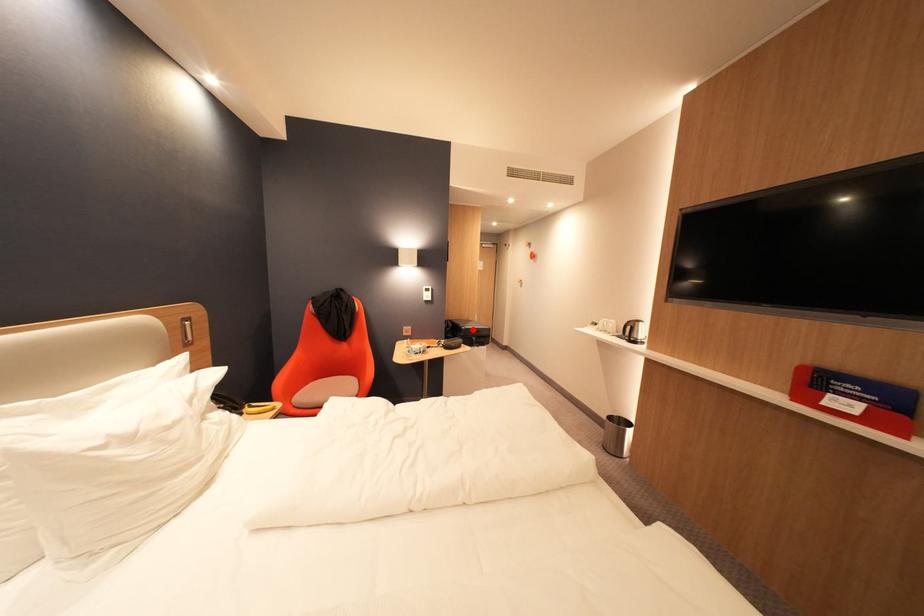
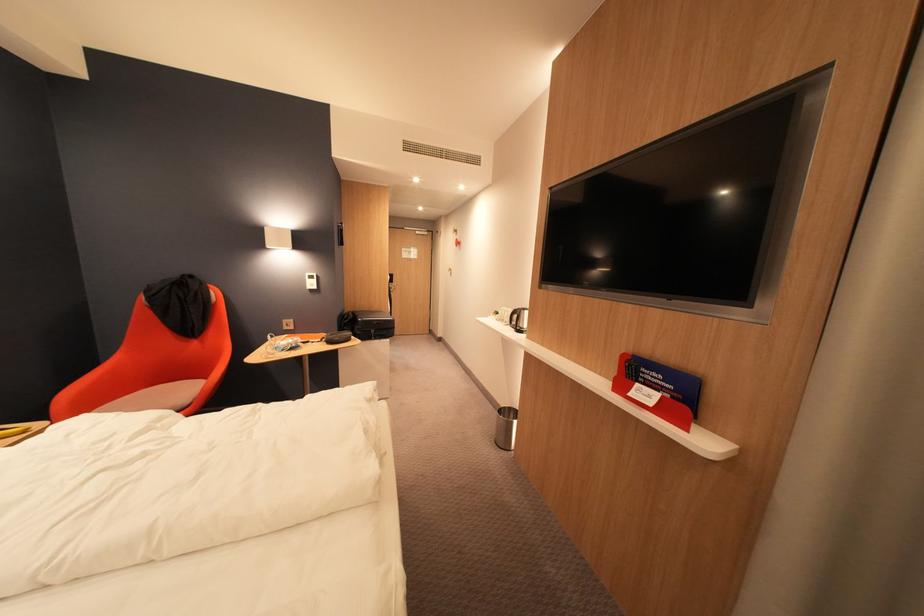
Where in the second image is the point corresponding to the highlighted location from the first image?

(370, 321)